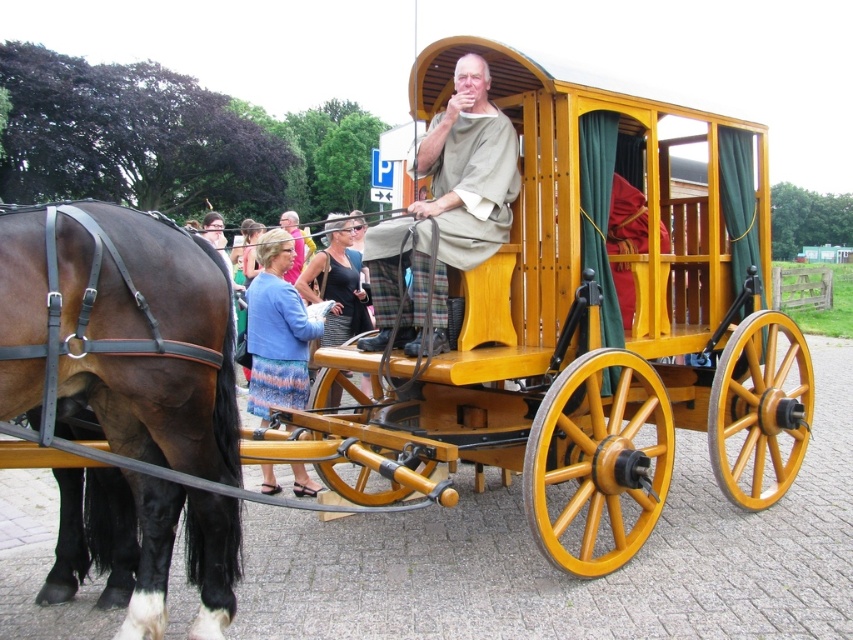
Question: Which object is closer to the camera taking this photo?

Choices:
 (A) blue fabric dress at lower left
 (B) brown leather harness at left
 (C) beige fabric robe at center

Answer: (B)

Question: Does brown leather harness at left have a lesser width compared to blue fabric dress at lower left?

Choices:
 (A) yes
 (B) no

Answer: (B)

Question: Which object appears closest to the camera in this image?

Choices:
 (A) beige fabric robe at center
 (B) blue fabric dress at lower left

Answer: (A)

Question: Can you confirm if beige fabric robe at center is positioned to the left of blue fabric dress at lower left?

Choices:
 (A) yes
 (B) no

Answer: (B)

Question: Which point is closer to the camera?

Choices:
 (A) brown leather harness at left
 (B) beige fabric robe at center
 (C) blue fabric dress at lower left

Answer: (A)

Question: Is beige fabric robe at center above blue fabric dress at lower left?

Choices:
 (A) yes
 (B) no

Answer: (A)